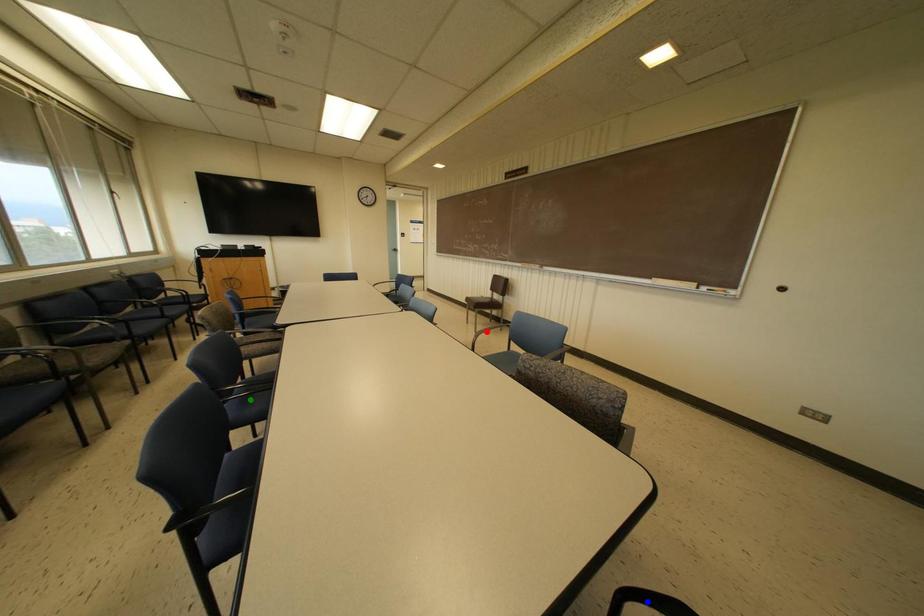
Order these from nearest to farthest:
A) blue point
B) red point
C) green point

blue point → green point → red point